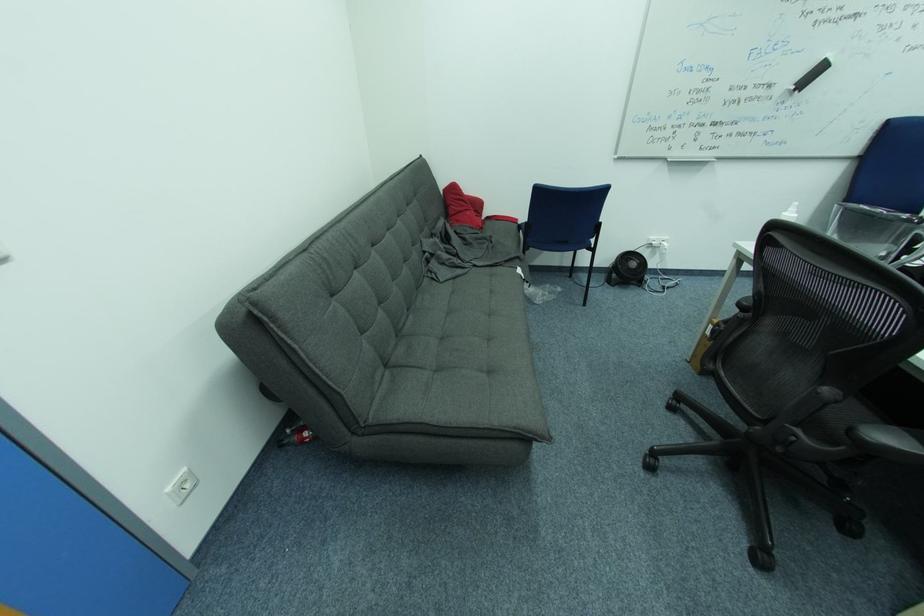
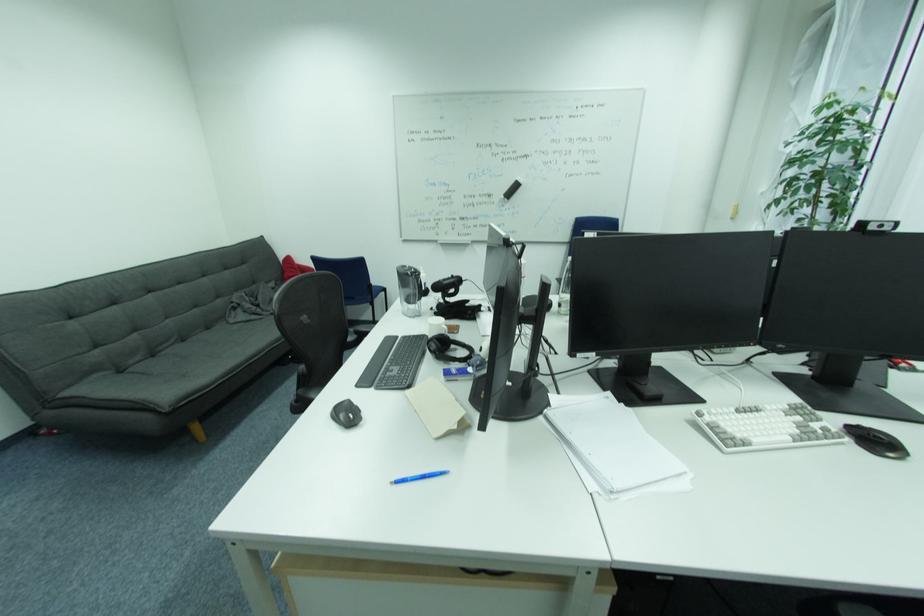
In a continuous first-person perspective shot, in which direction is the camera moving?

The cameraman moved toward right, backward.